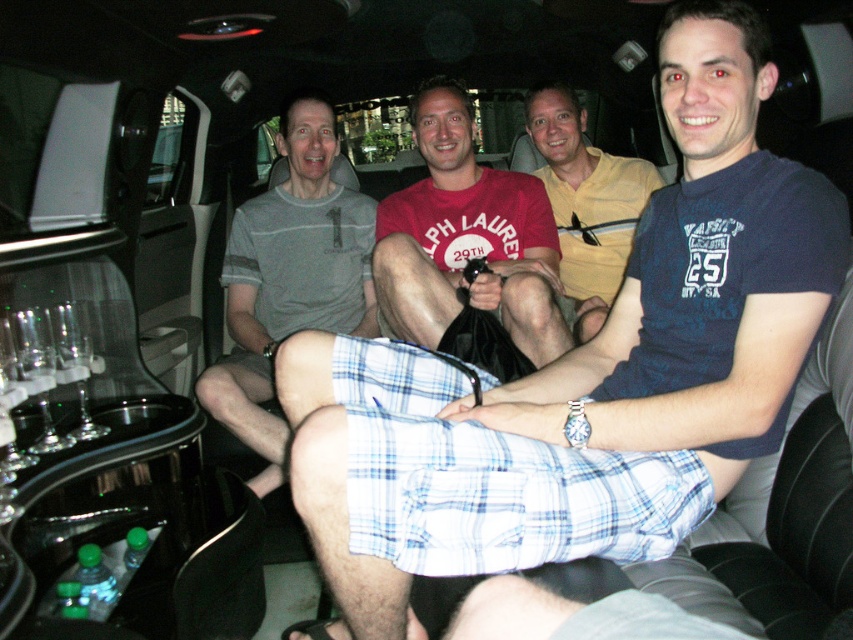
You are sitting in the limousine and want to reach a point in front of you. Which of the two points, point (515, 221) or point (636, 200), is closer to you?

Point (515, 221) is in front of point (636, 200), so it is closer to you.